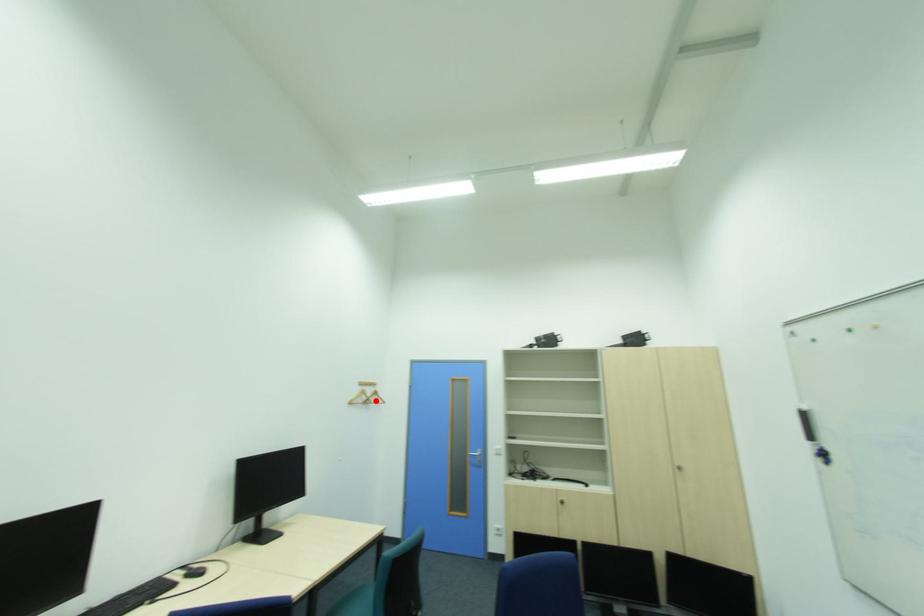
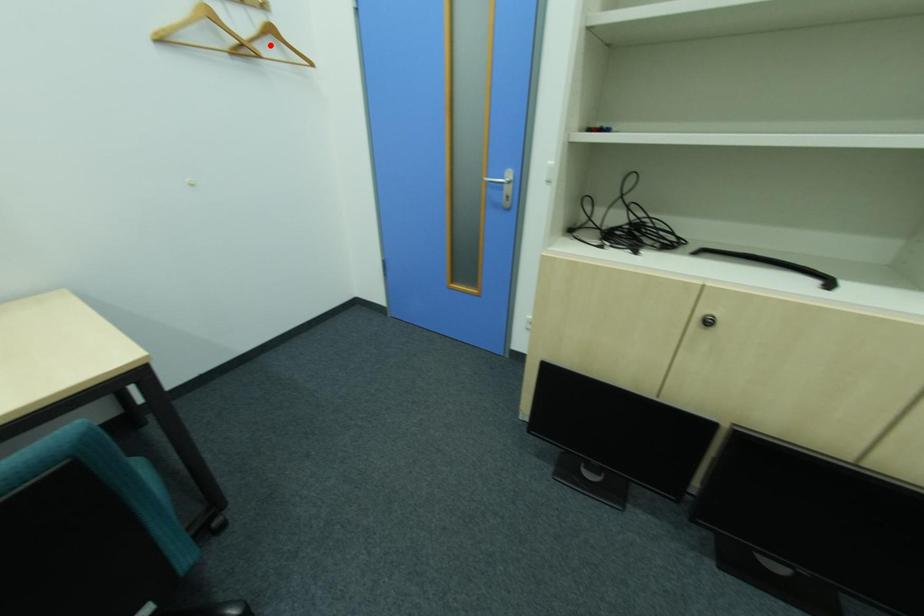
I am providing you with two images of the same scene from different viewpoints. A red point is marked on the first image and another point is marked on the second image. Do the highlighted points in image1 and image2 indicate the same real-world spot?

No